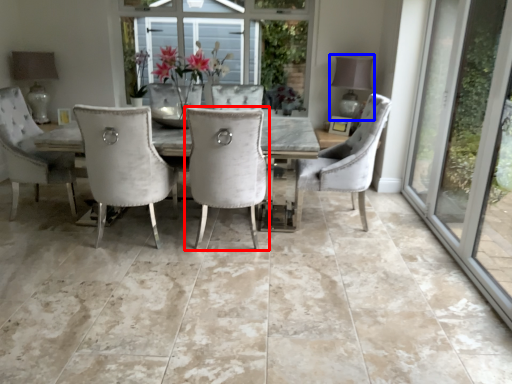
Question: Which of the following is the closest to the observer, chair (highlighted by a red box) or lamp (highlighted by a blue box)?

Choices:
 (A) chair
 (B) lamp

Answer: (A)